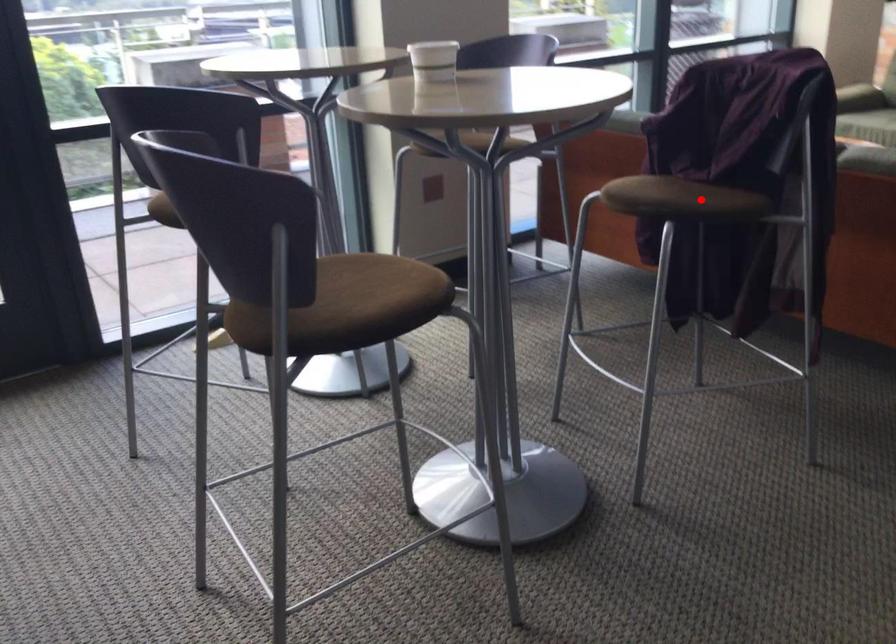
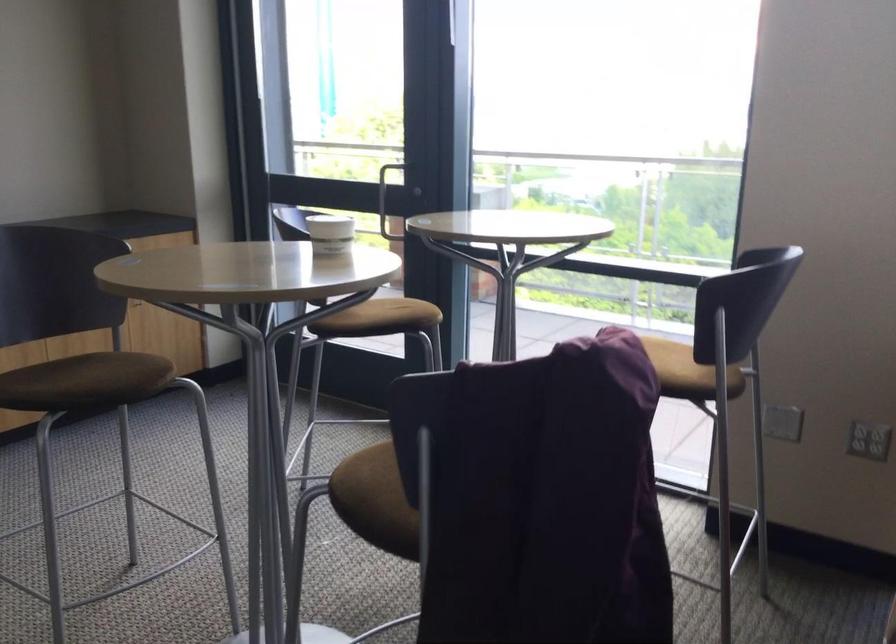
Question: I am providing you with two images of the same scene from different viewpoints. In image1, a red point is highlighted. Considering the same 3D point in image2, which of the following is correct?

Choices:
 (A) It is closer
 (B) It is farther

Answer: (A)